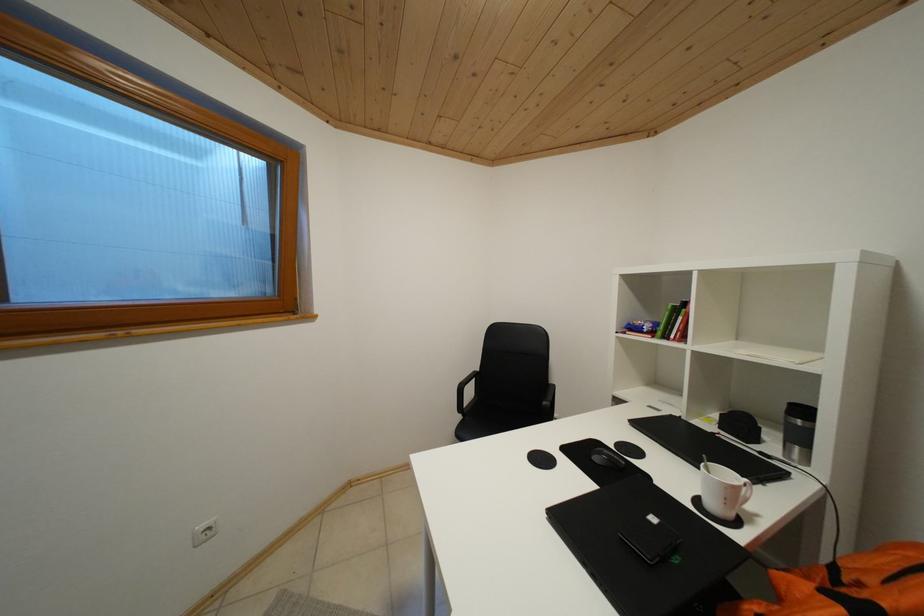
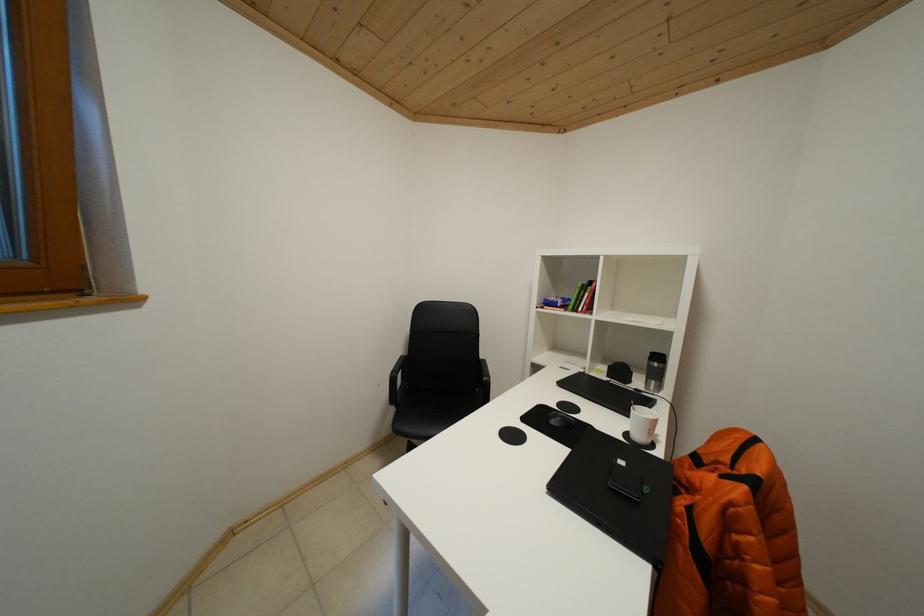
What movement of the cameraman would produce the second image?

The movement direction of the cameraman is left, forward.